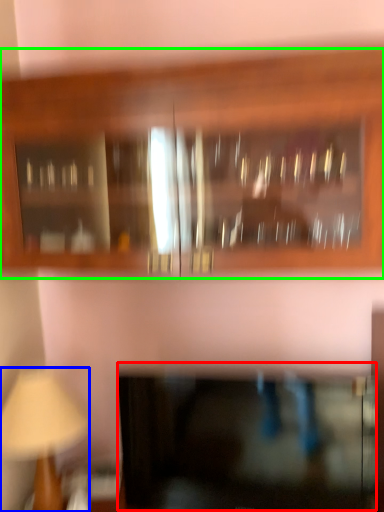
Question: Estimate the real-world distances between objects in this image. Which object is farther from cabinetry (highlighted by a red box), table lamp (highlighted by a blue box) or cabinetry (highlighted by a green box)?

Choices:
 (A) table lamp
 (B) cabinetry

Answer: (B)